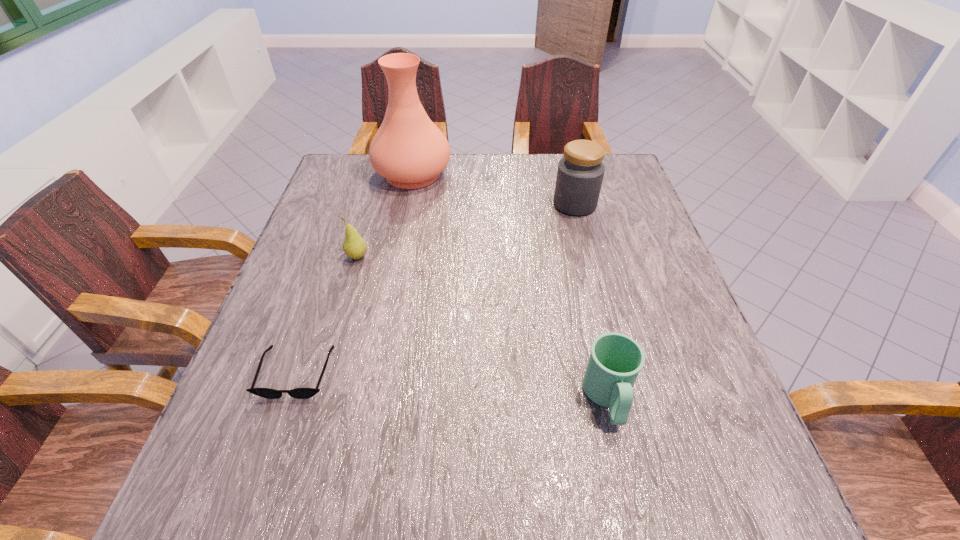
You are a GUI agent. You are given a task and a screenshot of the screen. Output one action in this format:
    pyautogui.click(x=<x>, y=<y>)
    Task: Click on the tallest object
    
    Given the screenshot: What is the action you would take?
    pyautogui.click(x=409, y=150)

Identify the location of the fourth shortest object. This screenshot has width=960, height=540. (580, 173).

Locate an element on the screen. Image resolution: width=960 pixels, height=540 pixels. the third farthest object is located at coordinates (354, 246).

Find the location of a particular element. mug is located at coordinates (616, 359).

The height and width of the screenshot is (540, 960). In order to click on sunglasses in this screenshot , I will do tap(300, 393).

Identify the location of vacant space located on the left of the tallest object. This screenshot has height=540, width=960. (345, 174).

This screenshot has width=960, height=540. I want to click on free region located 0.210m on the surface of the second tallest object near the warning symbol, so click(x=477, y=204).

At what (x,y) coordinates should I click in order to perform the action: click on blank space located on the surface of the second tallest object near the warning symbol. Please return your answer as a coordinate pair (x, y). Image resolution: width=960 pixels, height=540 pixels. Looking at the image, I should click on (452, 204).

Image resolution: width=960 pixels, height=540 pixels. I want to click on vacant region located on the surface of the second tallest object near the warning symbol, so click(x=452, y=204).

I want to click on free space located on the front of the pear, so click(x=325, y=368).